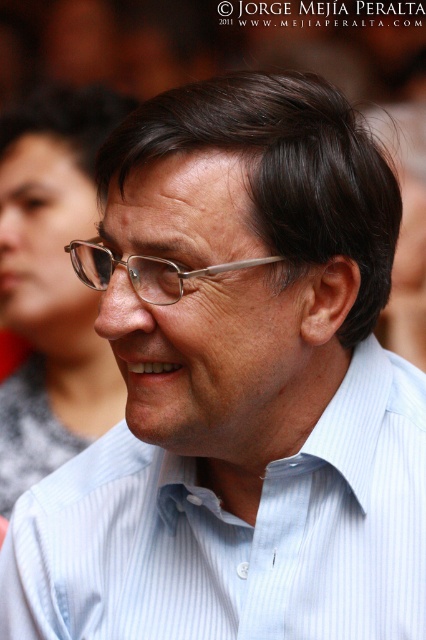
Question: Can you confirm if light blue striped dress shirt at center is wider than metallic silver glasses at center?

Choices:
 (A) yes
 (B) no

Answer: (A)

Question: Which point is farther to the camera?

Choices:
 (A) (11, 627)
 (B) (86, 252)

Answer: (A)

Question: Which point is farther to the camera?

Choices:
 (A) metallic silver glasses at center
 (B) light blue striped dress shirt at center

Answer: (B)

Question: Which point appears farthest from the camera in this image?

Choices:
 (A) (357, 524)
 (B) (187, 272)

Answer: (A)

Question: Can you confirm if light blue striped dress shirt at center is positioned to the left of metallic silver glasses at center?

Choices:
 (A) no
 (B) yes

Answer: (A)

Question: Is light blue striped dress shirt at center to the right of metallic silver glasses at center from the viewer's perspective?

Choices:
 (A) yes
 (B) no

Answer: (A)